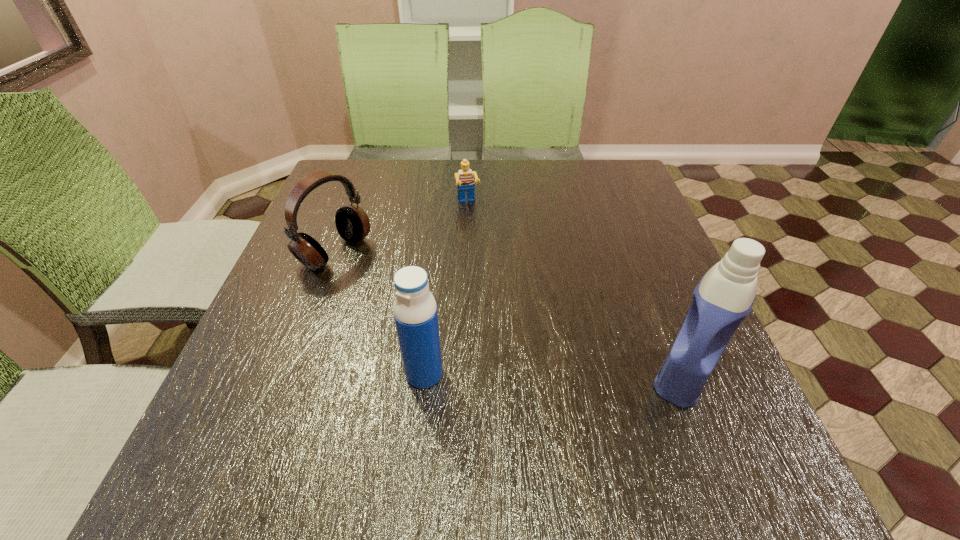
Locate an element on the screen. The height and width of the screenshot is (540, 960). the third shortest object is located at coordinates (415, 312).

Identify the location of the third object from right to left. (415, 312).

The width and height of the screenshot is (960, 540). I want to click on detergent, so click(x=724, y=297).

Where is `the tallest object`? The image size is (960, 540). the tallest object is located at coordinates (724, 297).

You are a GUI agent. You are given a task and a screenshot of the screen. Output one action in this format:
    pyautogui.click(x=<x>, y=<y>)
    Task: Click on the farthest object
    This screenshot has height=540, width=960.
    Given the screenshot: What is the action you would take?
    pyautogui.click(x=464, y=178)

The height and width of the screenshot is (540, 960). Identify the location of the third object from left to right. (464, 178).

I want to click on headset, so click(x=352, y=223).

Where is `the third nearest object`? The width and height of the screenshot is (960, 540). the third nearest object is located at coordinates (352, 223).

Where is `vacant space located on the left of the third shortest object`? vacant space located on the left of the third shortest object is located at coordinates (328, 374).

Where is `free space located 0.230m on the back of the tallest object`? free space located 0.230m on the back of the tallest object is located at coordinates (639, 265).